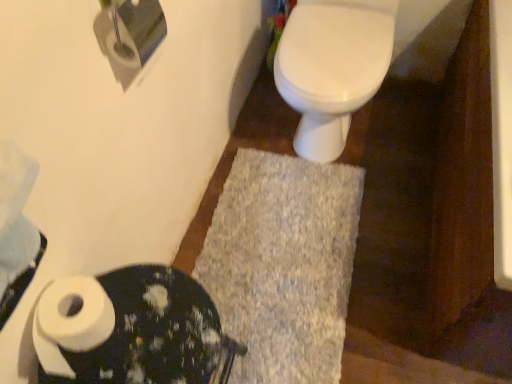
I want to click on free point above gray shaggy bath mat at center (from a real-world perspective), so click(275, 251).